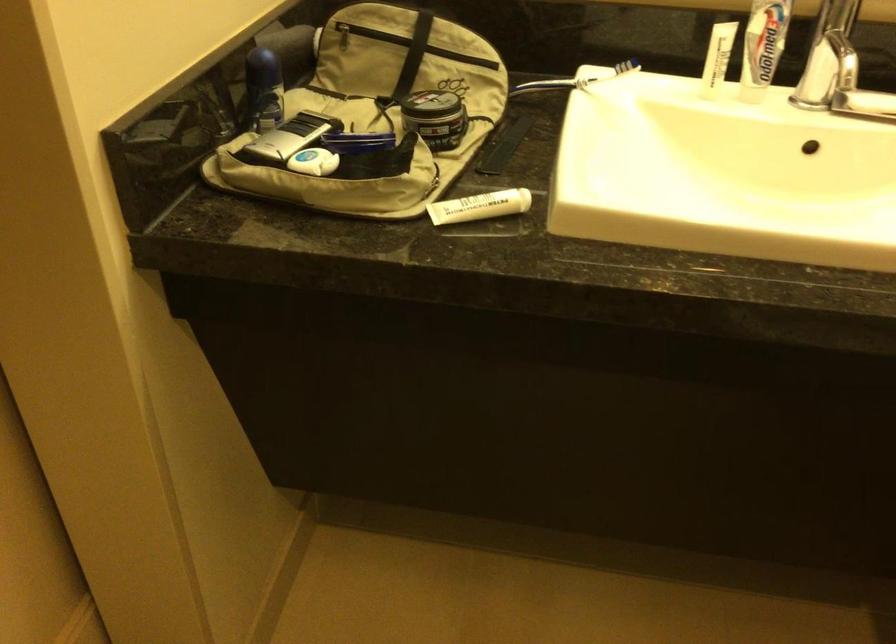
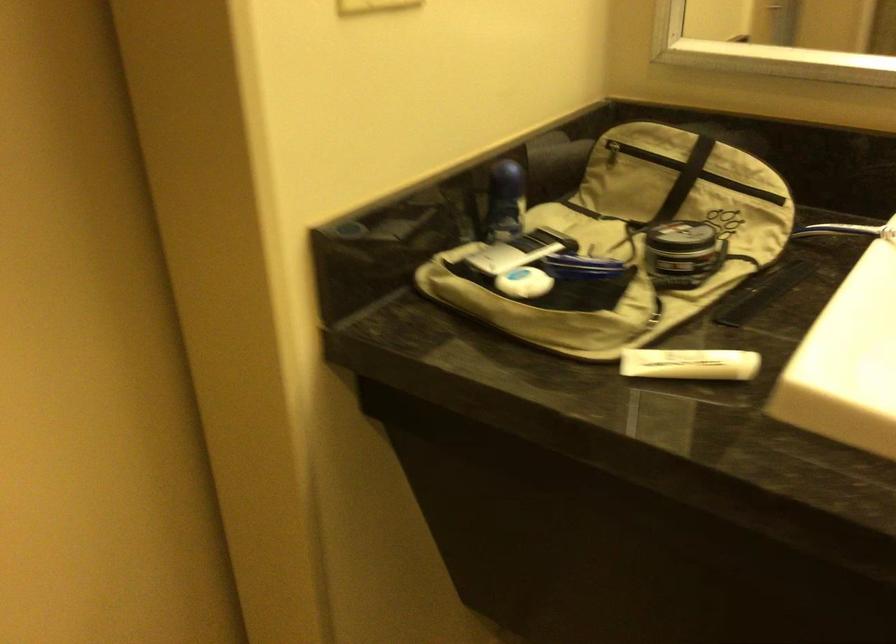
The images are taken continuously from a first-person perspective. In which direction are you moving?

The movement direction of the cameraman is right, forward.